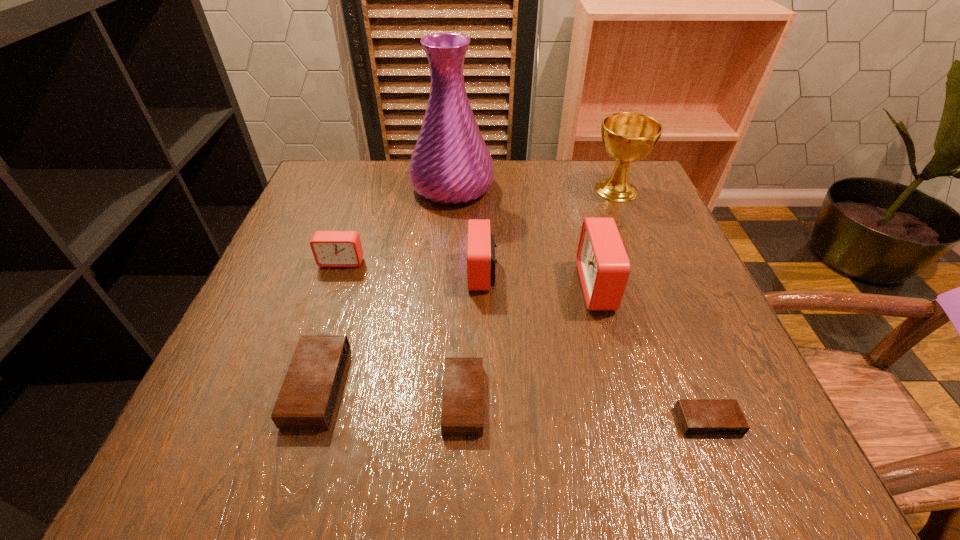
What are the coordinates of `vase` in the screenshot? It's located at (450, 164).

Image resolution: width=960 pixels, height=540 pixels. Find the location of `purple vase`. purple vase is located at coordinates pos(450,164).

What are the coordinates of `chalice` in the screenshot? It's located at (627, 137).

Where is `gold chalice`? Image resolution: width=960 pixels, height=540 pixels. gold chalice is located at coordinates (627, 137).

The image size is (960, 540). In order to click on the rightmost red alarm clock in this screenshot , I will do `click(603, 265)`.

I want to click on the tallest alarm clock, so click(x=603, y=265).

Where is `the fifth shortest alarm clock`? the fifth shortest alarm clock is located at coordinates (481, 245).

Where is `the second red alarm clock from right to left`? This screenshot has width=960, height=540. the second red alarm clock from right to left is located at coordinates (481, 245).

Where is `the fourth shortest alarm clock`? This screenshot has width=960, height=540. the fourth shortest alarm clock is located at coordinates (330, 248).

The image size is (960, 540). In order to click on the smallest red alarm clock in this screenshot , I will do `click(330, 248)`.